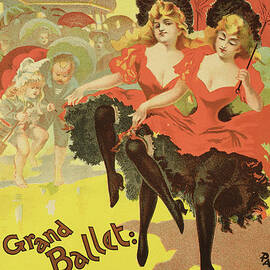
The image size is (270, 270). Identify the location of artwork. (125, 175).